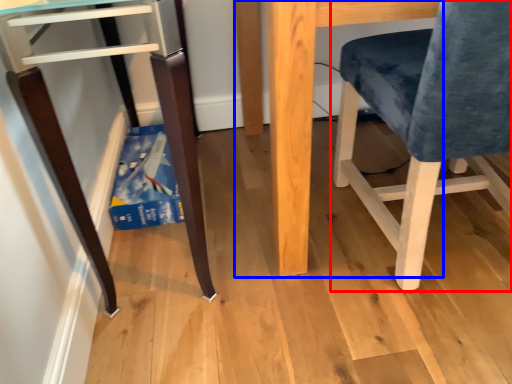
Question: Which of the following is the farthest to the observer, chair (highlighted by a red box) or table (highlighted by a blue box)?

Choices:
 (A) chair
 (B) table

Answer: (B)